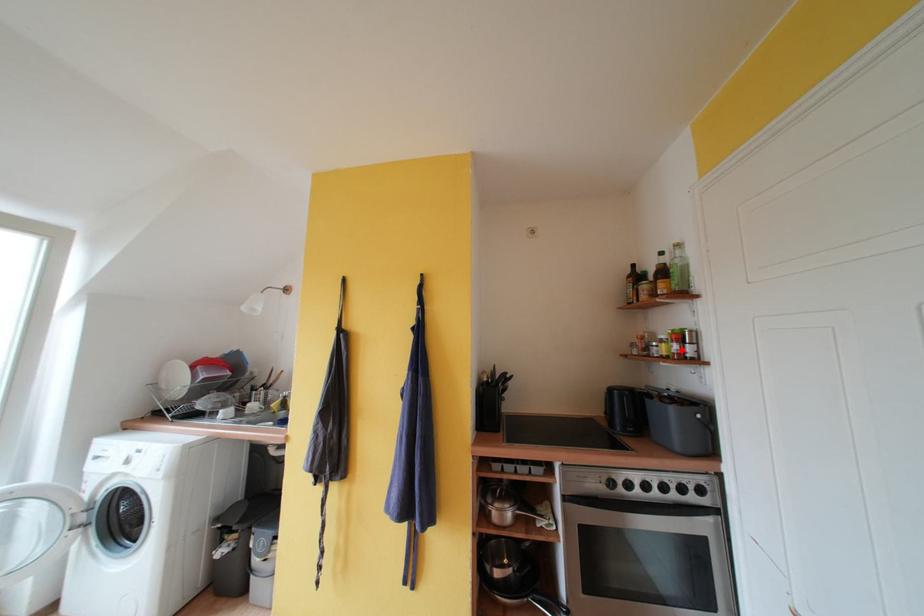
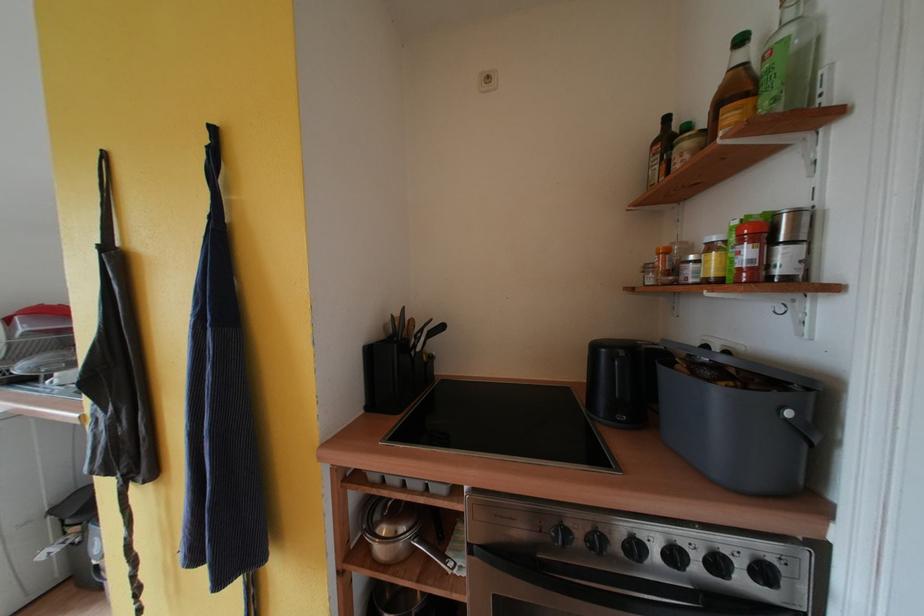
In the second image, find the point that corresponds to the highlighted location in the first image.

(755, 256)